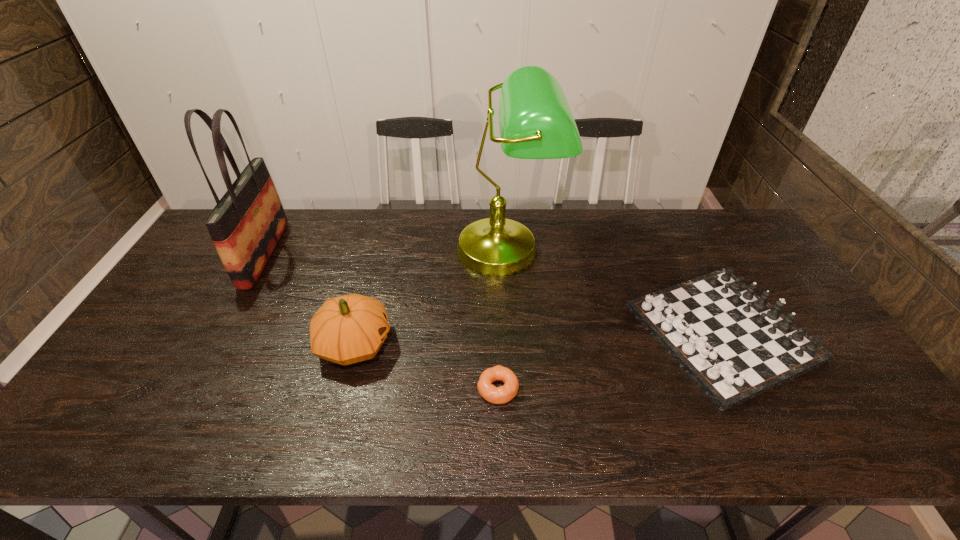
Where is `lamp`? The image size is (960, 540). lamp is located at coordinates (535, 120).

Where is `shopping bag`? shopping bag is located at coordinates (247, 223).

The width and height of the screenshot is (960, 540). In order to click on the fourth object from right to left in this screenshot , I will do `click(347, 329)`.

Identify the location of gourd. The width and height of the screenshot is (960, 540). pos(347,329).

At what (x,y) coordinates should I click in order to perform the action: click on the rightmost object. Please return your answer as a coordinate pair (x, y). This screenshot has width=960, height=540. Looking at the image, I should click on (734, 345).

This screenshot has width=960, height=540. Find the location of `the second shortest object`. the second shortest object is located at coordinates (734, 345).

Where is `doughnut`? doughnut is located at coordinates (497, 395).

Locate an element on the screen. vacant space located 0.070m on the desk next to the lamp is located at coordinates (511, 307).

You are a GUI agent. You are given a task and a screenshot of the screen. Output one action in this format:
    pyautogui.click(x=<x>, y=<y>)
    Task: Click on the vacant space located 0.190m on the front-facing side of the shopping bag
    The height and width of the screenshot is (540, 960).
    Given the screenshot: What is the action you would take?
    pyautogui.click(x=337, y=254)

Where is `vacant area situated 0.210m on the side of the fourth object from right to left with the carved face`? The width and height of the screenshot is (960, 540). vacant area situated 0.210m on the side of the fourth object from right to left with the carved face is located at coordinates (472, 343).